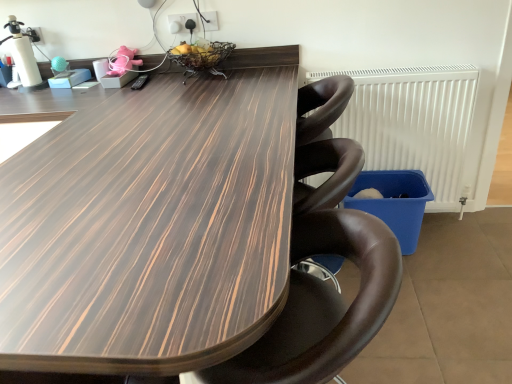
Question: Is pink fabric toy at upper center aimed at brown leather chair at center?

Choices:
 (A) yes
 (B) no

Answer: (B)

Question: From a real-world perspective, is pink fabric toy at upper center located higher than brown leather chair at center?

Choices:
 (A) yes
 (B) no

Answer: (A)

Question: Is pink fabric toy at upper center in front of brown leather chair at center?

Choices:
 (A) yes
 (B) no

Answer: (B)

Question: From the image's perspective, would you say pink fabric toy at upper center is shown under brown leather chair at center?

Choices:
 (A) yes
 (B) no

Answer: (B)

Question: Does pink fabric toy at upper center lie behind brown leather chair at center?

Choices:
 (A) no
 (B) yes

Answer: (B)

Question: Is pink fabric toy at upper center surrounding brown leather chair at center?

Choices:
 (A) no
 (B) yes

Answer: (A)

Question: Does white plastic radiator at right come in front of brown leather chair at center?

Choices:
 (A) no
 (B) yes

Answer: (A)

Question: Is white plastic radiator at right oriented towards brown leather chair at center?

Choices:
 (A) yes
 (B) no

Answer: (A)

Question: Considering the relative sizes of white plastic radiator at right and brown leather chair at center in the image provided, is white plastic radiator at right wider than brown leather chair at center?

Choices:
 (A) no
 (B) yes

Answer: (A)

Question: Can you confirm if white plastic radiator at right is thinner than brown leather chair at center?

Choices:
 (A) yes
 (B) no

Answer: (A)

Question: Can you confirm if white plastic radiator at right is bigger than brown leather chair at center?

Choices:
 (A) yes
 (B) no

Answer: (B)

Question: Is the depth of white plastic radiator at right greater than that of brown leather chair at center?

Choices:
 (A) no
 (B) yes

Answer: (B)

Question: Can you confirm if brown leather chair at center is wider than white plastic radiator at right?

Choices:
 (A) yes
 (B) no

Answer: (A)